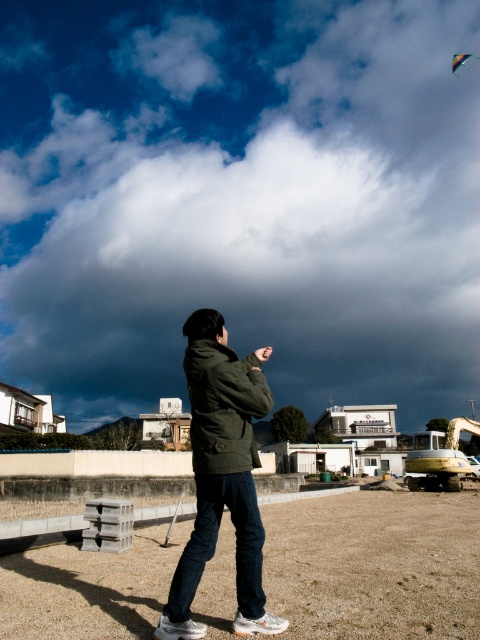
Question: Which object is the closest to the olive-green jacket at center?

Choices:
 (A) cloudy sky at upper center
 (B) multicolored fabric kite at upper right

Answer: (A)

Question: Among these objects, which one is nearest to the camera?

Choices:
 (A) multicolored fabric kite at upper right
 (B) cloudy sky at upper center
 (C) olive-green jacket at center

Answer: (C)

Question: Is cloudy sky at upper center to the left of olive-green jacket at center from the viewer's perspective?

Choices:
 (A) no
 (B) yes

Answer: (A)

Question: Does cloudy sky at upper center lie behind olive-green jacket at center?

Choices:
 (A) yes
 (B) no

Answer: (A)

Question: Which point is farther to the camera?

Choices:
 (A) (456, 64)
 (B) (240, 465)

Answer: (A)

Question: Does cloudy sky at upper center appear on the right side of olive-green jacket at center?

Choices:
 (A) yes
 (B) no

Answer: (A)